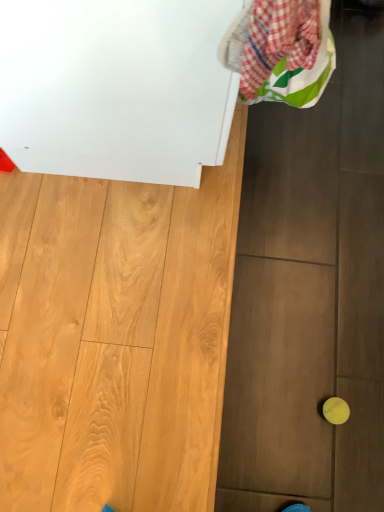
Question: Can you confirm if yellow rubber ball at lower right is bigger than plaid fabric laundry at upper right?

Choices:
 (A) no
 (B) yes

Answer: (A)

Question: Is yellow rubber ball at lower right taller than plaid fabric laundry at upper right?

Choices:
 (A) yes
 (B) no

Answer: (B)

Question: Considering the relative sizes of yellow rubber ball at lower right and plaid fabric laundry at upper right in the image provided, is yellow rubber ball at lower right smaller than plaid fabric laundry at upper right?

Choices:
 (A) no
 (B) yes

Answer: (B)

Question: From the image's perspective, is yellow rubber ball at lower right under plaid fabric laundry at upper right?

Choices:
 (A) yes
 (B) no

Answer: (A)

Question: From a real-world perspective, is yellow rubber ball at lower right positioned under plaid fabric laundry at upper right based on gravity?

Choices:
 (A) yes
 (B) no

Answer: (A)

Question: From the image's perspective, relative to yellow rubber ball at lower right, is white glossy cabinet at upper left above or below?

Choices:
 (A) above
 (B) below

Answer: (A)

Question: Is white glossy cabinet at upper left in front of or behind yellow rubber ball at lower right in the image?

Choices:
 (A) front
 (B) behind

Answer: (A)

Question: Is white glossy cabinet at upper left taller or shorter than yellow rubber ball at lower right?

Choices:
 (A) short
 (B) tall

Answer: (B)

Question: Is white glossy cabinet at upper left bigger or smaller than yellow rubber ball at lower right?

Choices:
 (A) small
 (B) big

Answer: (B)

Question: In terms of width, does white glossy cabinet at upper left look wider or thinner when compared to plaid fabric laundry at upper right?

Choices:
 (A) wide
 (B) thin

Answer: (A)

Question: Is point (11, 110) positioned closer to the camera than point (332, 45)?

Choices:
 (A) farther
 (B) closer

Answer: (B)

Question: Is white glossy cabinet at upper left taller or shorter than plaid fabric laundry at upper right?

Choices:
 (A) short
 (B) tall

Answer: (B)

Question: Which is correct: white glossy cabinet at upper left is inside plaid fabric laundry at upper right, or outside of it?

Choices:
 (A) outside
 (B) inside

Answer: (A)

Question: Does point (329, 420) appear closer or farther from the camera than point (228, 31)?

Choices:
 (A) closer
 (B) farther

Answer: (B)

Question: Looking at their shapes, would you say yellow rubber ball at lower right is wider or thinner than plaid fabric laundry at upper right?

Choices:
 (A) wide
 (B) thin

Answer: (B)